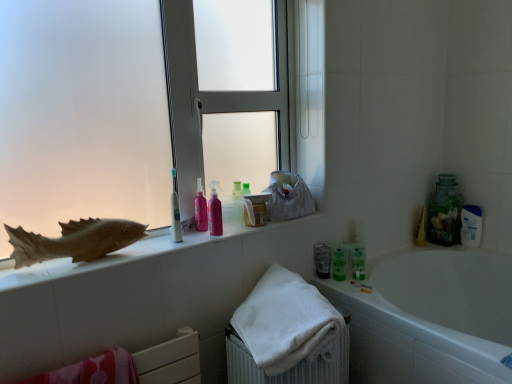
Where is `free space in front of green matte tube at center, acting as the third mouthwash starting from the front`? This screenshot has width=512, height=384. free space in front of green matte tube at center, acting as the third mouthwash starting from the front is located at coordinates (346, 285).